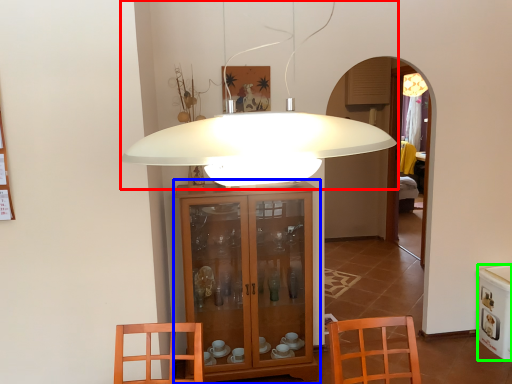
Question: Considering the real-world distances, which object is farthest from lamp (highlighted by a red box)? cabinetry (highlighted by a blue box) or appliance (highlighted by a green box)?

Choices:
 (A) cabinetry
 (B) appliance

Answer: (B)